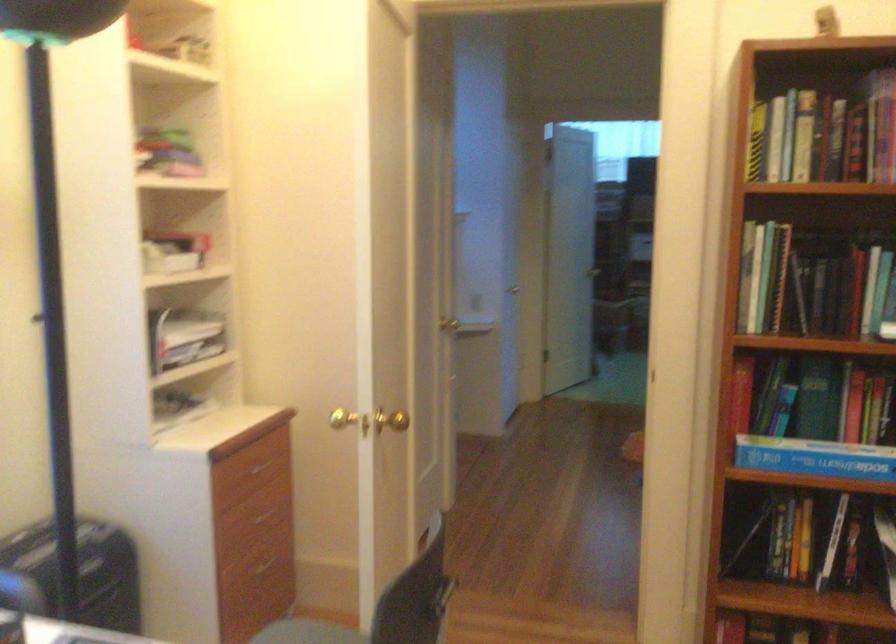
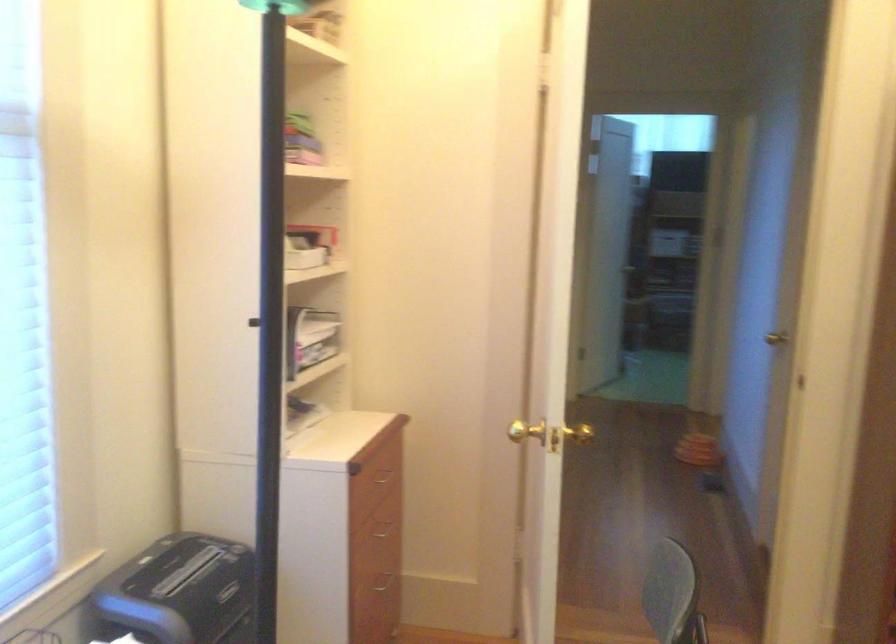
Locate, in the second image, the point that corresponds to (257,469) in the first image.

(383, 478)